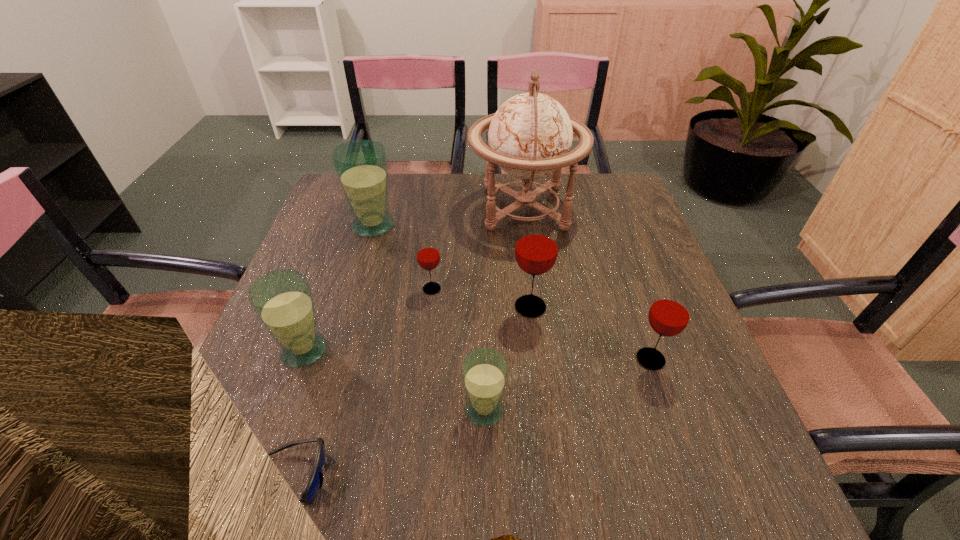
Where is `vacant position located on the front of the rightmost glass`? The height and width of the screenshot is (540, 960). vacant position located on the front of the rightmost glass is located at coordinates (670, 416).

I want to click on vacant space located on the front of the fourth glass from right to left, so click(x=420, y=390).

Where is `vacant space situated on the right of the rightmost blue glass`? vacant space situated on the right of the rightmost blue glass is located at coordinates (593, 410).

The width and height of the screenshot is (960, 540). Identify the location of free space located 0.130m on the front-facing side of the shortest object. (408, 477).

Locate an element on the screen. globe located in the far edge section of the desktop is located at coordinates (530, 136).

Locate an element on the screen. The height and width of the screenshot is (540, 960). glass at the far edge is located at coordinates (361, 166).

This screenshot has height=540, width=960. Identify the location of object situated at the near edge. (314, 483).

Identify the location of sunglasses located in the left edge section of the desktop. (314, 483).

Identify the location of object that is positioned at the right edge. This screenshot has height=540, width=960. (670, 312).

Find the location of a particular element. object that is at the far left corner is located at coordinates (361, 166).